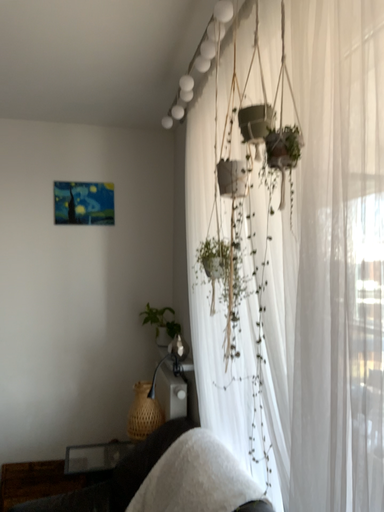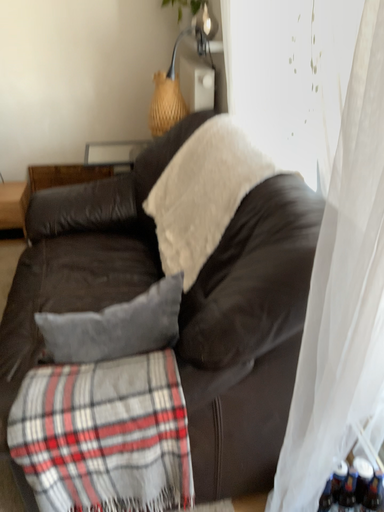
Question: How did the camera likely rotate when shooting the video?

Choices:
 (A) rotated upward
 (B) rotated downward

Answer: (B)